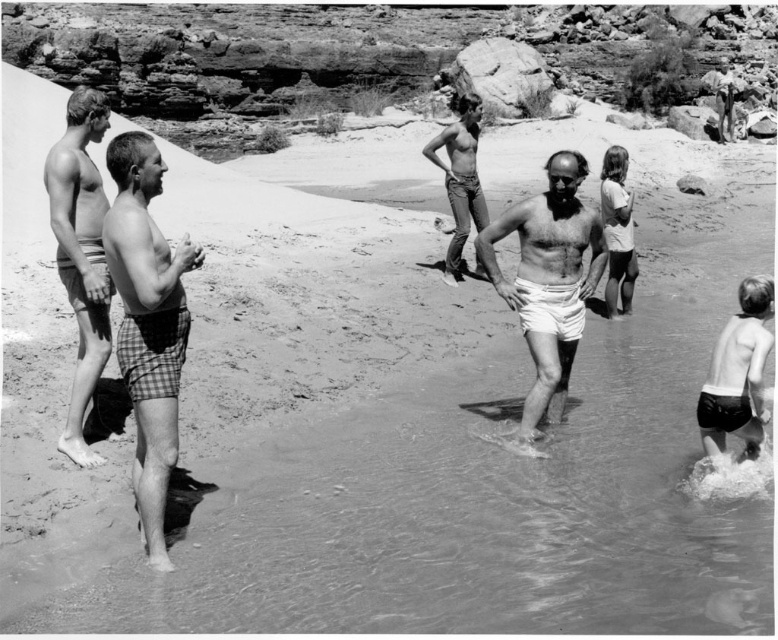
Question: Which point is closer to the camera?

Choices:
 (A) (601, 209)
 (B) (104, 269)
 (C) (124, 371)

Answer: (C)

Question: Which point is closer to the camera?

Choices:
 (A) smooth white shirt at upper right
 (B) black matte shorts at lower right
 (C) checkered fabric shorts at left
 (D) smooth white shorts at left

Answer: (C)

Question: Does checkered fabric shorts at left appear over smooth white shirt at upper right?

Choices:
 (A) yes
 (B) no

Answer: (B)

Question: Which object is farther from the camera taking this photo?

Choices:
 (A) checkered fabric shorts at left
 (B) black matte shorts at lower right
 (C) smooth white shirt at upper right

Answer: (C)

Question: Does black matte shorts at lower right have a larger size compared to smooth white shirt at upper right?

Choices:
 (A) no
 (B) yes

Answer: (A)

Question: Is smooth white shorts at left above smooth white shirt at upper right?

Choices:
 (A) no
 (B) yes

Answer: (B)